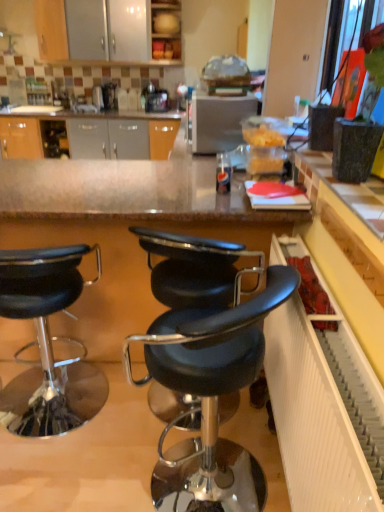
Question: Relative to black leather stool at center, placed as the third chair when sorted from left to right, is white glossy sink at upper center in front or behind?

Choices:
 (A) front
 (B) behind

Answer: (B)

Question: Which is correct: white glossy sink at upper center is inside black leather stool at center, placed as the third chair when sorted from left to right, or outside of it?

Choices:
 (A) outside
 (B) inside

Answer: (A)

Question: Which is nearer to the satin silver toaster at center?

Choices:
 (A) black leather stool at center, placed as the third chair when sorted from left to right
 (B) black leather stool at left, which is the 1th chair in left-to-right order
 (C) black leather stool at center, which is counted as the 2th chair, starting from the left
 (D) white glossy sink at upper center

Answer: (C)

Question: Based on their relative distances, which object is nearer to the black leather stool at center, which is counted as the 2th chair, starting from the left?

Choices:
 (A) satin silver toaster at center
 (B) black leather stool at center, which ranks as the 1th chair in right-to-left order
 (C) black leather stool at left, which is the 1th chair in left-to-right order
 (D) white glossy sink at upper center

Answer: (B)